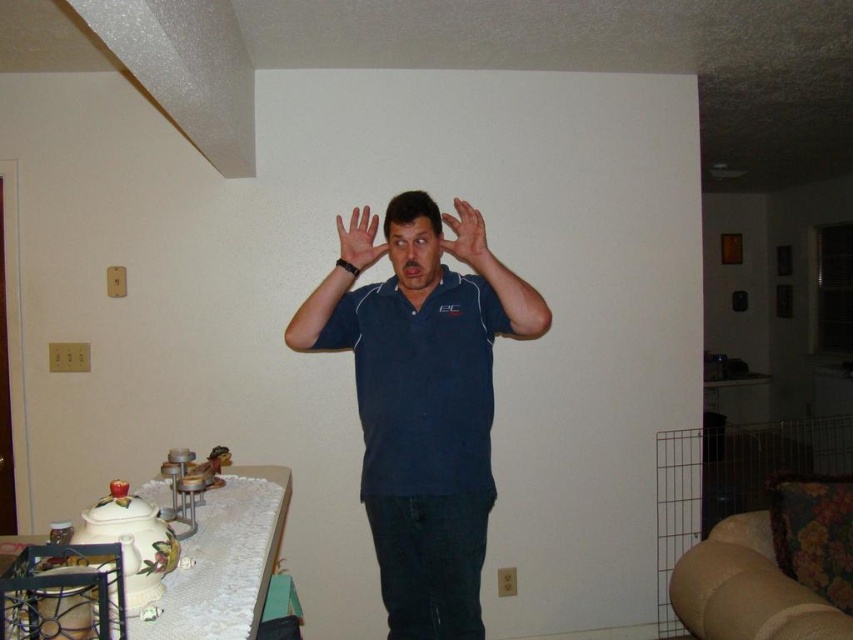
Question: Which is nearer to the dark blue polo shirt at center?

Choices:
 (A) matte blue polo shirt at center
 (B) matte blue shirt at center
 (C) matte black hand at center

Answer: (A)

Question: Which point is farther to the camera?

Choices:
 (A) matte black hand at center
 (B) matte blue polo shirt at center
 (C) matte blue shirt at center

Answer: (B)

Question: From the image, what is the correct spatial relationship of matte blue polo shirt at center in relation to matte blue shirt at center?

Choices:
 (A) below
 (B) above

Answer: (A)

Question: Can you confirm if dark blue polo shirt at center is bigger than matte blue polo shirt at center?

Choices:
 (A) no
 (B) yes

Answer: (B)

Question: Can you confirm if matte blue polo shirt at center is wider than matte blue shirt at center?

Choices:
 (A) no
 (B) yes

Answer: (B)

Question: Among these objects, which one is farthest from the camera?

Choices:
 (A) matte blue polo shirt at center
 (B) dark blue polo shirt at center
 (C) matte black hand at center

Answer: (A)